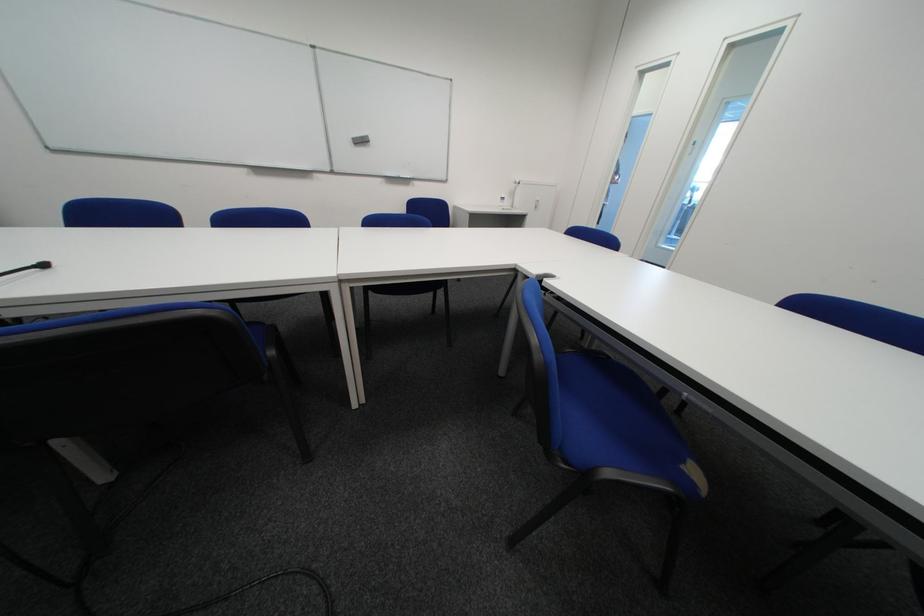
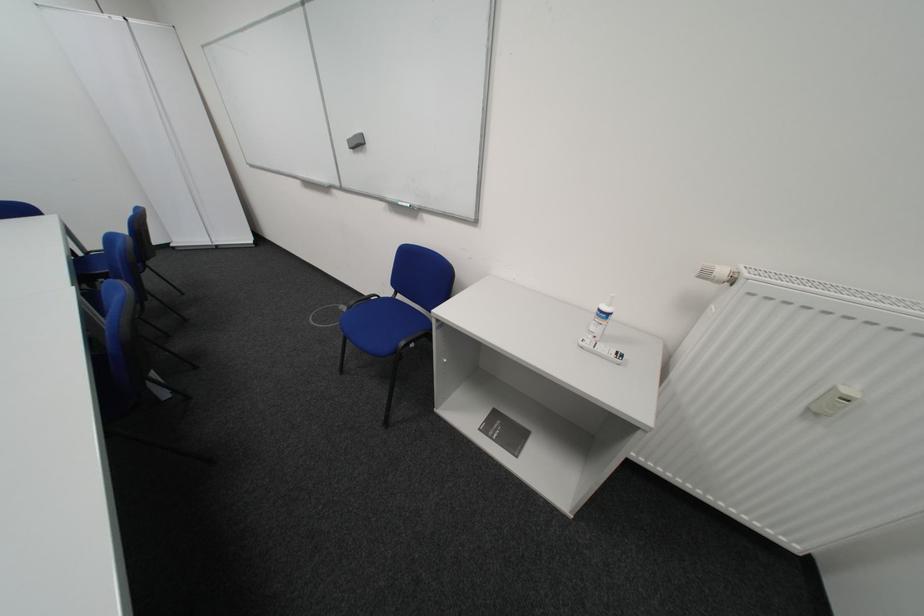
Find the pixel in the second image that matches point (365, 140) in the first image.

(361, 143)